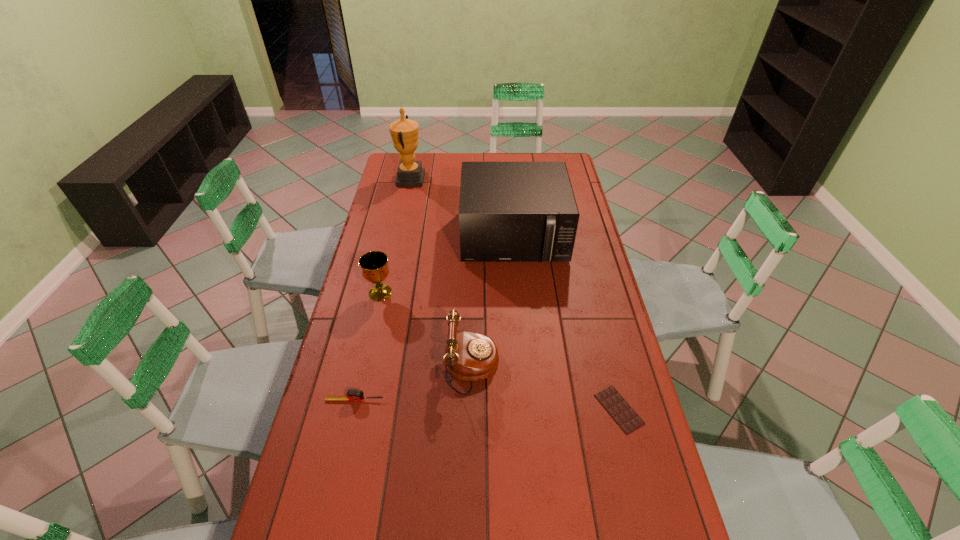
Image resolution: width=960 pixels, height=540 pixels. Identify the location of vacant area between the telephone and the award. (441, 273).

Where is `vacant point located between the tape measure and the telephone`? This screenshot has width=960, height=540. vacant point located between the tape measure and the telephone is located at coordinates (413, 383).

I want to click on free space between the fifth shortest object and the fourth nearest object, so click(447, 265).

Image resolution: width=960 pixels, height=540 pixels. Identify the location of free space between the shortest object and the telephone. tap(545, 388).

Locate an element on the screen. free area in between the telephone and the fifth tallest object is located at coordinates 413,383.

The height and width of the screenshot is (540, 960). Identify the location of object that can be found as the closest to the tape measure. (469, 356).

In order to click on object that is the fifth closest one to the award in this screenshot , I will do `click(623, 414)`.

What are the coordinates of `free spot that satisfies the following two spatial constraints: 1. on the front-facing side of the microwave oven; 2. on the dial of the telephone` in the screenshot? It's located at (524, 366).

At what (x,y) coordinates should I click in order to perform the action: click on vacant point that satisfies the following two spatial constraints: 1. on the back side of the shortest object; 2. on the dial of the telephone. Please return your answer as a coordinate pair (x, y). The image size is (960, 540). Looking at the image, I should click on (609, 366).

Image resolution: width=960 pixels, height=540 pixels. What are the coordinates of `vacant area that satisfies the following two spatial constraints: 1. on the back side of the shortest object; 2. at the front of the award with handles` in the screenshot? It's located at (562, 179).